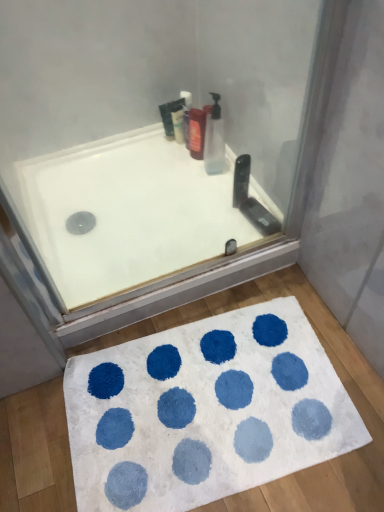
Question: Could you tell me if white glossy bathtub at upper center is turned towards shiny plastic soap dispenser at upper center?

Choices:
 (A) no
 (B) yes

Answer: (A)

Question: Considering the relative sizes of white glossy bathtub at upper center and shiny plastic soap dispenser at upper center in the image provided, is white glossy bathtub at upper center shorter than shiny plastic soap dispenser at upper center?

Choices:
 (A) no
 (B) yes

Answer: (B)

Question: Is shiny plastic soap dispenser at upper center completely or partially inside white glossy bathtub at upper center?

Choices:
 (A) no
 (B) yes

Answer: (A)

Question: Is shiny plastic soap dispenser at upper center at the back of white glossy bathtub at upper center?

Choices:
 (A) yes
 (B) no

Answer: (B)

Question: From a real-world perspective, is white glossy bathtub at upper center on top of shiny plastic soap dispenser at upper center?

Choices:
 (A) yes
 (B) no

Answer: (B)

Question: Can you confirm if white glossy bathtub at upper center is positioned to the left of shiny plastic soap dispenser at upper center?

Choices:
 (A) yes
 (B) no

Answer: (A)

Question: Is translucent plastic bottle at upper center, which appears as the 1th cleaning product when viewed from the left, to the right of shiny plastic soap dispenser at upper center from the viewer's perspective?

Choices:
 (A) yes
 (B) no

Answer: (B)

Question: Does translucent plastic bottle at upper center, the second cleaning product in the right-to-left sequence, appear on the left side of shiny plastic soap dispenser at upper center?

Choices:
 (A) no
 (B) yes

Answer: (B)

Question: Can you confirm if translucent plastic bottle at upper center, which is counted as the 1th cleaning product, starting from the back, is shorter than shiny plastic soap dispenser at upper center?

Choices:
 (A) no
 (B) yes

Answer: (A)

Question: Considering the relative positions of translucent plastic bottle at upper center, which appears as the 1th cleaning product when viewed from the left, and shiny plastic soap dispenser at upper center in the image provided, is translucent plastic bottle at upper center, which appears as the 1th cleaning product when viewed from the left, in front of shiny plastic soap dispenser at upper center?

Choices:
 (A) yes
 (B) no

Answer: (B)

Question: Is translucent plastic bottle at upper center, which appears as the 1th cleaning product when viewed from the left, taller than shiny plastic soap dispenser at upper center?

Choices:
 (A) yes
 (B) no

Answer: (A)

Question: Does shiny plastic soap dispenser at upper center touch white shaggy bath mat at lower center?

Choices:
 (A) yes
 (B) no

Answer: (B)